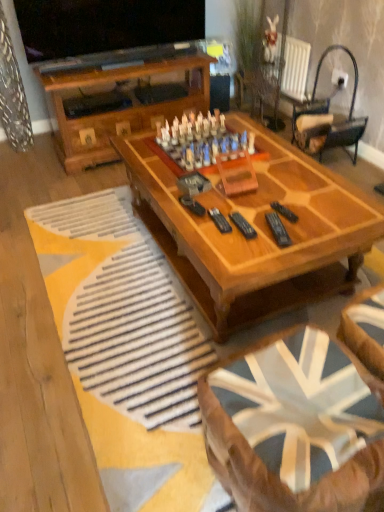
Find the location of a particular element. The width and height of the screenshot is (384, 512). vacant region in front of black plastic remote at center, which is the 2th remote in left-to-right order is located at coordinates (273, 254).